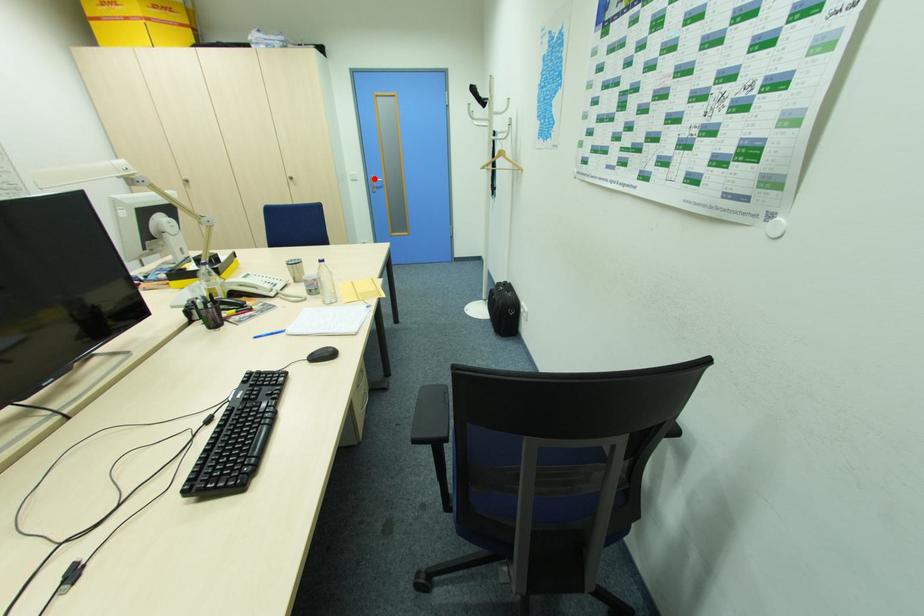
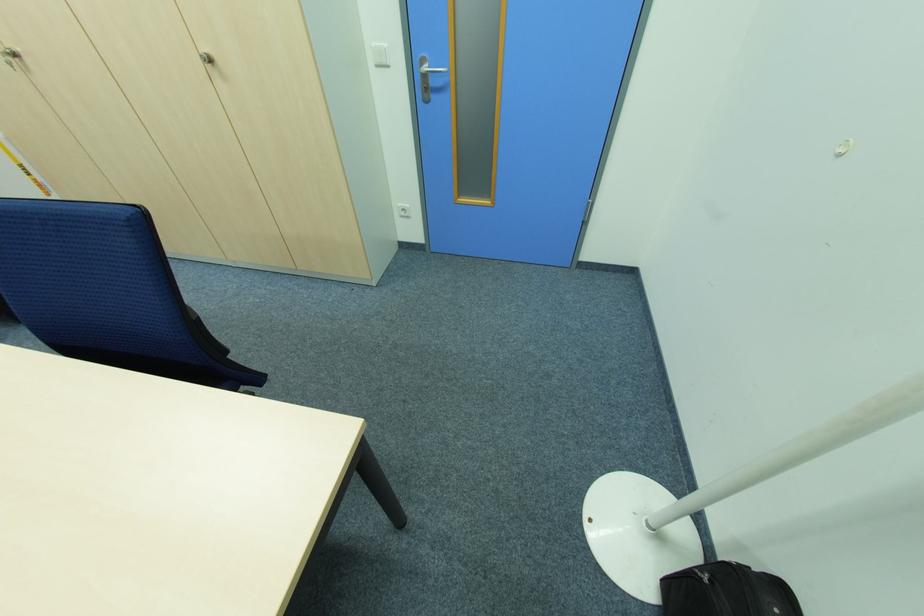
Find the pixel in the second image that matches the highlighted location in the first image.

(424, 63)